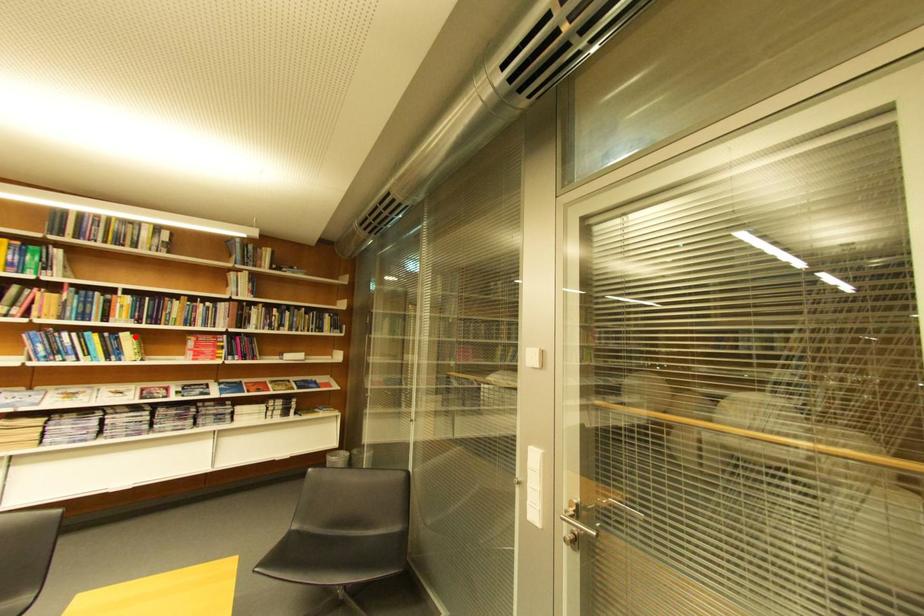
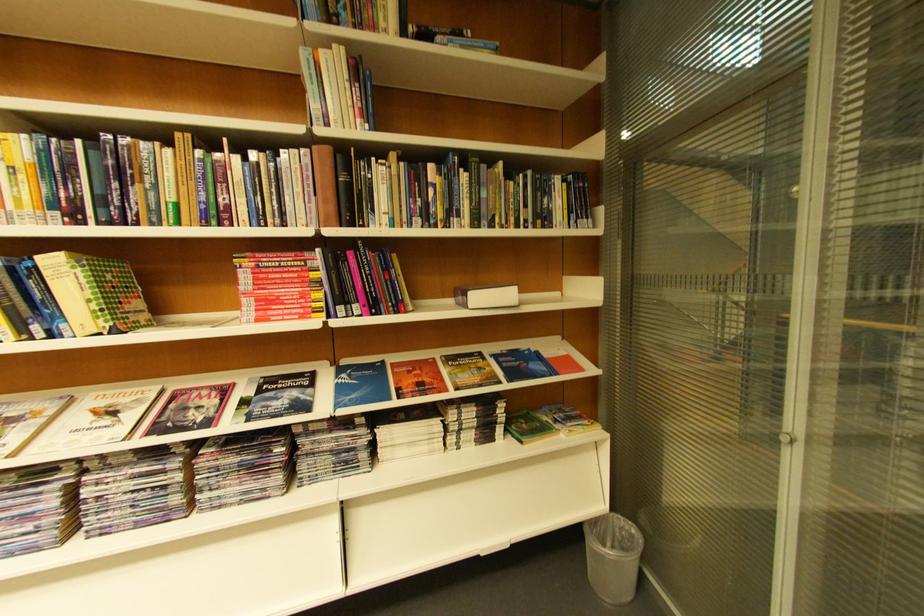
The point at the highlighted location is marked in the first image. Where is the corresponding point in the second image?

(63, 264)